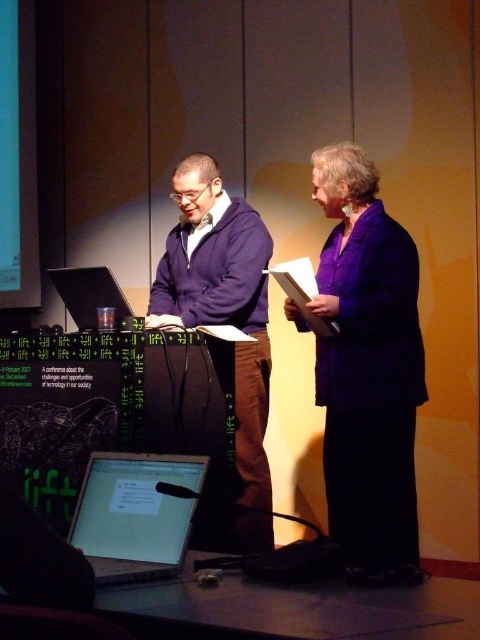
Question: Does purple fabric jacket at center appear under shiny silver laptop at lower left?

Choices:
 (A) no
 (B) yes

Answer: (A)

Question: Which point is closer to the camera taking this photo?

Choices:
 (A) (119, 502)
 (B) (323, 157)

Answer: (A)

Question: Does purple fabric jacket at center lie in front of shiny silver laptop at lower left?

Choices:
 (A) no
 (B) yes

Answer: (A)

Question: Is purple fabric jacket at center above purple fleece jacket at center?

Choices:
 (A) no
 (B) yes

Answer: (B)

Question: Which object is farther from the camera taking this photo?

Choices:
 (A) purple fabric jacket at center
 (B) shiny silver laptop at lower left
 (C) purple fleece jacket at center

Answer: (C)

Question: Which of the following is the farthest from the observer?

Choices:
 (A) (191, 188)
 (B) (334, 458)
 (C) (100, 456)

Answer: (A)